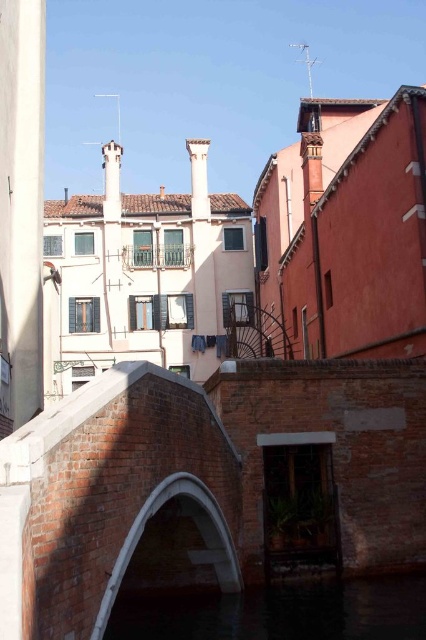
You are standing on the small arched bridge and looking towards the reddish brown building. Which object is closer to your right side, the dark water at bridge center or the white stone archway at center?

The dark water at bridge center is to the right of the white stone archway at center, so the dark water at bridge center is closer to your right side.

You are standing on the small arched bridge in the image. You want to take a photo of the dark water at bridge center. Where should you aim your camera to capture it?

You should aim your camera at point coordinates (x=282, y=612) to capture the dark water at bridge center.